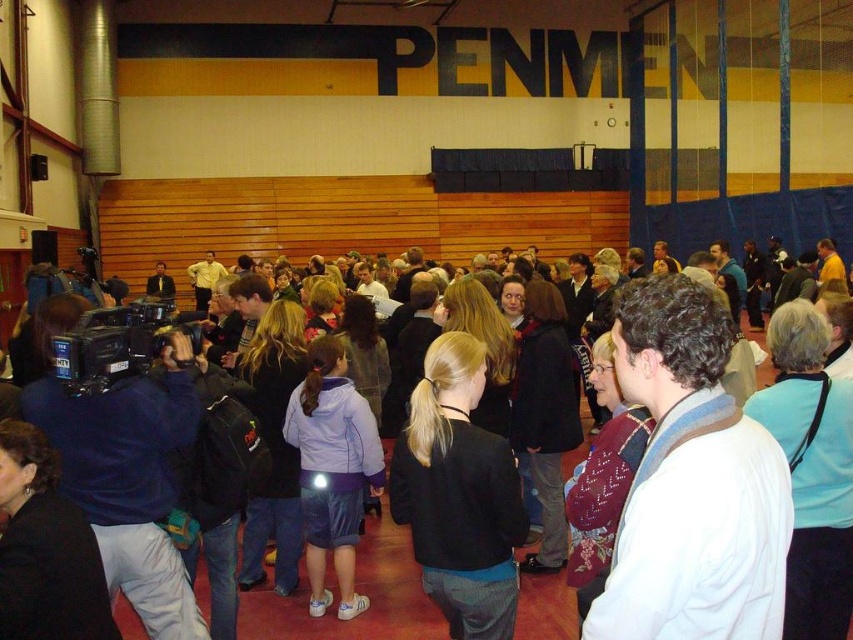
What do you see at coordinates (692, 483) in the screenshot? I see `white wool sweater at center` at bounding box center [692, 483].

Between point (699, 314) and point (476, 353), which one is positioned behind?

Point (476, 353)

Find the location of a particular element. Image resolution: width=853 pixels, height=640 pixels. white wool sweater at center is located at coordinates (692, 483).

Is black matte jacket at center taller than light purple fleece jacket at center?

No.

Who is more forward, (469,468) or (306,500)?

Point (469,468) is more forward.

What are the coordinates of `black matte jacket at center` in the screenshot? It's located at coord(457,493).

Can you confirm if white wool sweater at center is bigger than light purple fleece jacket at center?

No.

This screenshot has height=640, width=853. What do you see at coordinates (692, 483) in the screenshot?
I see `white wool sweater at center` at bounding box center [692, 483].

Where is `white wool sweater at center`? The image size is (853, 640). white wool sweater at center is located at coordinates (692, 483).